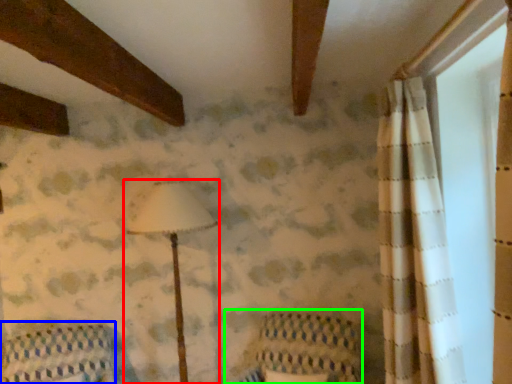
Question: Which object is the closest to the lamp (highlighted by a red box)? Choose among these: furniture (highlighted by a blue box) or armchair (highlighted by a green box).

Choices:
 (A) furniture
 (B) armchair

Answer: (B)